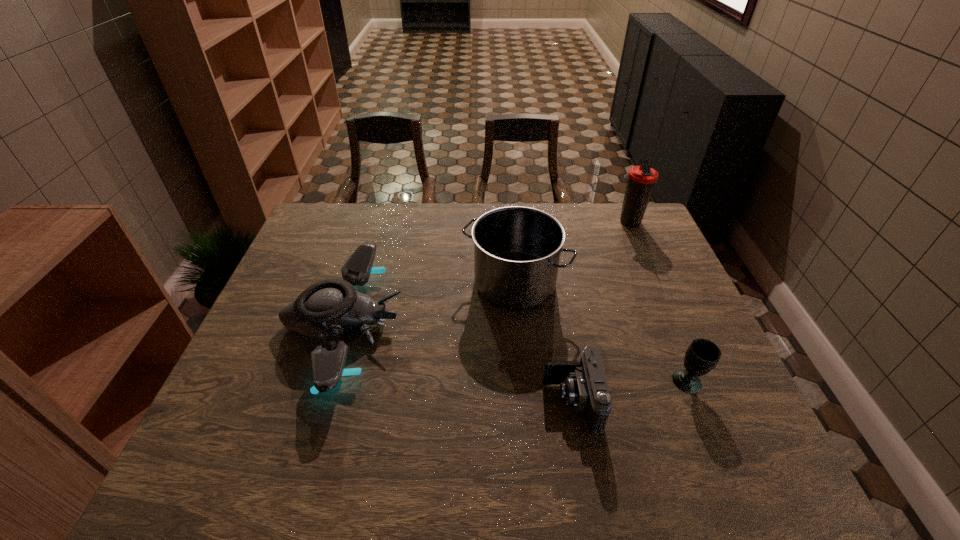
Locate an element on the screen. This screenshot has width=960, height=540. free location that satisfies the following two spatial constraints: 1. on the front-facing side of the leftmost object; 2. on the left side of the chalice is located at coordinates (325, 382).

The height and width of the screenshot is (540, 960). I want to click on blank area in the image that satisfies the following two spatial constraints: 1. on the front side of the chalice; 2. at the front of the camera with an open lens cover, so click(696, 402).